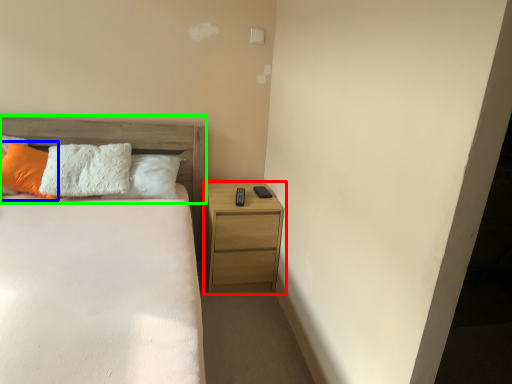
Question: Based on their relative distances, which object is farther from nightstand (highlighted by a red box)? Choose from pillow (highlighted by a blue box) and headboard (highlighted by a green box).

Choices:
 (A) pillow
 (B) headboard

Answer: (A)